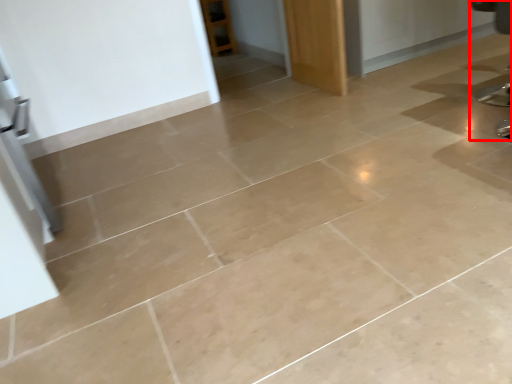
Question: Where is swivel chair (annotated by the red box) located in relation to door in the image?

Choices:
 (A) right
 (B) left

Answer: (A)